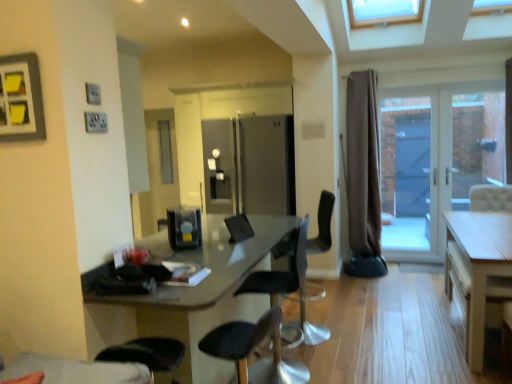
In order to face brown fabric curtain at right, should I rotate leftwards or rightwards?

You should look right and rotate roughly 14.294 degrees.

What do you see at coordinates (362, 177) in the screenshot? I see `brown fabric curtain at right` at bounding box center [362, 177].

This screenshot has width=512, height=384. Describe the element at coordinates (435, 161) in the screenshot. I see `white glossy door at right` at that location.

The image size is (512, 384). What are the coordinates of `black plastic chair at center, arranged as the third chair when viewed from the front` in the screenshot? It's located at (305, 311).

Describe the element at coordinates (477, 143) in the screenshot. This screenshot has height=384, width=512. I see `clear glass door at right` at that location.

The width and height of the screenshot is (512, 384). Identify the location of matte gray picture frame at upper left. (21, 99).

Between matte gray picture frame at upper left and white glossy door at right, which one is positioned behind?

white glossy door at right is more distant.

From the image's perspective, between matte gray picture frame at upper left and white glossy door at right, who is located below?

white glossy door at right appears lower in the image.

From a real-world perspective, is matte gray picture frame at upper left on top of white glossy door at right?

Yes, from a real-world perspective, matte gray picture frame at upper left is on top of white glossy door at right.

Looking at this image, which object is wider, matte gray picture frame at upper left or white glossy door at right?

With larger width is white glossy door at right.

Considering the positions of objects black plastic chair at center, which is counted as the 2th chair, starting from the front, and satin black coffee machine at center in the image provided, who is behind, black plastic chair at center, which is counted as the 2th chair, starting from the front, or satin black coffee machine at center?

satin black coffee machine at center is more distant.

Is black plastic chair at center, which is counted as the 2th chair, starting from the front, facing towards satin black coffee machine at center?

Yes, black plastic chair at center, which is counted as the 2th chair, starting from the front, faces towards satin black coffee machine at center.

Considering the sizes of objects black plastic chair at center, placed as the 2th chair when sorted from back to front, and satin black coffee machine at center in the image provided, who is taller, black plastic chair at center, placed as the 2th chair when sorted from back to front, or satin black coffee machine at center?

black plastic chair at center, placed as the 2th chair when sorted from back to front.

Locate an element on the screen. The image size is (512, 384). chair that is the 1st one when counting forward from the satin black coffee machine at center is located at coordinates (280, 272).

Considering the relative positions of black plastic chair at center, arranged as the third chair when viewed from the front, and white glossy door at right in the image provided, is black plastic chair at center, arranged as the third chair when viewed from the front, to the left of white glossy door at right from the viewer's perspective?

Yes, black plastic chair at center, arranged as the third chair when viewed from the front, is to the left of white glossy door at right.

Considering the positions of points (322, 231) and (400, 199), is point (322, 231) closer to camera compared to point (400, 199)?

That is True.

Consider the image. Considering the sizes of black plastic chair at center, arranged as the third chair when viewed from the front, and white glossy door at right in the image, is black plastic chair at center, arranged as the third chair when viewed from the front, bigger or smaller than white glossy door at right?

In the image, black plastic chair at center, arranged as the third chair when viewed from the front, appears to be smaller than white glossy door at right.

Looking at their sizes, would you say black plastic chair at center, arranged as the third chair when viewed from the front, is wider or thinner than white glossy door at right?

In the image, black plastic chair at center, arranged as the third chair when viewed from the front, appears to be wider than white glossy door at right.

In the scene shown: Is clear glass door at right beside white glossy door at right?

No, clear glass door at right is not making contact with white glossy door at right.

You are a GUI agent. You are given a task and a screenshot of the screen. Output one action in this format:
    pyautogui.click(x=<x>, y=<y>)
    Task: Click on the window that appears in front of the white glossy door at right
    The height and width of the screenshot is (384, 512).
    Given the screenshot: What is the action you would take?
    pyautogui.click(x=477, y=143)

Does point (476, 105) lie behind point (426, 256)?

No, (476, 105) is in front of (426, 256).

Can you confirm if clear glass door at right is bigger than white glossy door at right?

No, clear glass door at right is not bigger than white glossy door at right.

Can you confirm if black plastic chair at center, marked as the 1th chair in a back-to-front arrangement, is positioned to the right of brown fabric curtain at right?

No, black plastic chair at center, marked as the 1th chair in a back-to-front arrangement, is not to the right of brown fabric curtain at right.

Which object is wider, black plastic chair at center, arranged as the third chair when viewed from the front, or brown fabric curtain at right?

Wider between the two is black plastic chair at center, arranged as the third chair when viewed from the front.

Does point (284, 323) appear closer or farther from the camera than point (365, 257)?

Point (284, 323) is closer to the camera than point (365, 257).

Looking at this image, is the depth of black plastic chair at center, marked as the 1th chair in a back-to-front arrangement, greater than that of brown fabric curtain at right?

No, it is not.

Can you confirm if light wood table at right is positioned to the left of clear glass screen door at right?

No, light wood table at right is not to the left of clear glass screen door at right.

From a real-world perspective, between light wood table at right and clear glass screen door at right, who is vertically higher?

clear glass screen door at right, from a real-world perspective.

Which object is more forward, light wood table at right or clear glass screen door at right?

light wood table at right.

Is brown fabric curtain at right positioned far away from black plastic chair at center, which is counted as the 2th chair, starting from the front?

Absolutely, brown fabric curtain at right is distant from black plastic chair at center, which is counted as the 2th chair, starting from the front.

From a real-world perspective, is brown fabric curtain at right positioned under black plastic chair at center, which is counted as the 2th chair, starting from the front, based on gravity?

No, from a real-world perspective, brown fabric curtain at right is not under black plastic chair at center, which is counted as the 2th chair, starting from the front.

Is brown fabric curtain at right surrounding black plastic chair at center, placed as the 2th chair when sorted from back to front?

No, black plastic chair at center, placed as the 2th chair when sorted from back to front, is not surrounded by brown fabric curtain at right.

What's the angular difference between brown fabric curtain at right and black plastic chair at center, which is counted as the 2th chair, starting from the front,'s facing directions?

brown fabric curtain at right and black plastic chair at center, which is counted as the 2th chair, starting from the front, are facing 85.8 degrees away from each other.

I want to click on picture frame in front of the white glossy door at right, so click(x=21, y=99).

Locate an element on the screen. appliance above the black plastic chair at center, placed as the 2th chair when sorted from back to front (from the image's perspective) is located at coordinates (184, 227).

Considering their positions, is brown fabric curtain at right positioned closer to black leather chair at center, the third chair in the back-to-front sequence, than black plastic chair at center, which is counted as the 2th chair, starting from the front?

black plastic chair at center, which is counted as the 2th chair, starting from the front, is closer to black leather chair at center, the third chair in the back-to-front sequence.

From the image, which object appears to be farther from matte gray picture frame at upper left, black plastic chair at center, arranged as the third chair when viewed from the front, or clear glass door at right?

Based on the image, clear glass door at right appears to be further to matte gray picture frame at upper left.

Based on their spatial positions, is brown fabric curtain at right or matte gray picture frame at upper left further from black plastic chair at center, placed as the 2th chair when sorted from back to front?

The object further to black plastic chair at center, placed as the 2th chair when sorted from back to front, is matte gray picture frame at upper left.

When comparing their distances from clear glass screen door at right, does satin black coffee machine at center or white glossy door at right seem closer?

The object closer to clear glass screen door at right is white glossy door at right.

Considering their positions, is white glossy door at right positioned further to matte gray picture frame at upper left than light wood table at right?

white glossy door at right is further to matte gray picture frame at upper left.

Which object lies further to the anchor point black plastic chair at center, marked as the 1th chair in a back-to-front arrangement, satin black coffee machine at center or clear glass door at right?

clear glass door at right is positioned further to the anchor black plastic chair at center, marked as the 1th chair in a back-to-front arrangement.

From the image, which object appears to be farther from black leather chair at center, the third chair in the back-to-front sequence, black plastic chair at center, which is counted as the 2th chair, starting from the front, or black plastic chair at center, arranged as the third chair when viewed from the front?

black plastic chair at center, arranged as the third chair when viewed from the front, is positioned further to the anchor black leather chair at center, the third chair in the back-to-front sequence.

When comparing their distances from black plastic chair at center, which is counted as the 2th chair, starting from the front, does black leather chair at center, which is the first chair in front-to-back order, or brown fabric curtain at right seem further?

brown fabric curtain at right is positioned further to the anchor black plastic chair at center, which is counted as the 2th chair, starting from the front.

The height and width of the screenshot is (384, 512). I want to click on door between black plastic chair at center, marked as the 1th chair in a back-to-front arrangement, and clear glass door at right, in the horizontal direction, so click(x=435, y=161).

Find the location of `table located between black plastic chair at center, placed as the 2th chair when sorted from back to front, and white glossy door at right in the depth direction`. table located between black plastic chair at center, placed as the 2th chair when sorted from back to front, and white glossy door at right in the depth direction is located at coordinates (478, 270).

At what (x,y) coordinates should I click in order to perform the action: click on door positioned between light wood table at right and clear glass screen door at right from near to far. Please return your answer as a coordinate pair (x, y). The height and width of the screenshot is (384, 512). Looking at the image, I should click on (435, 161).

The image size is (512, 384). I want to click on curtain between matte gray picture frame at upper left and light wood table at right, so click(x=362, y=177).